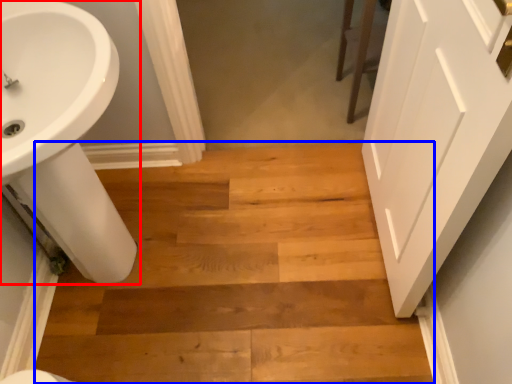
Question: Which of the following is the farthest to the observer, sink (highlighted by a red box) or stairwell (highlighted by a blue box)?

Choices:
 (A) sink
 (B) stairwell

Answer: (B)